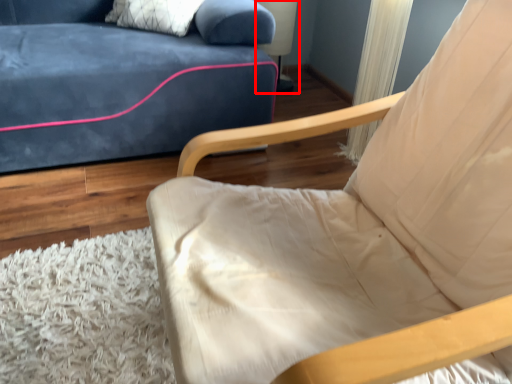
Question: From the image's perspective, what is the correct spatial positioning of table lamp (annotated by the red box) in reference to chair?

Choices:
 (A) below
 (B) above

Answer: (B)